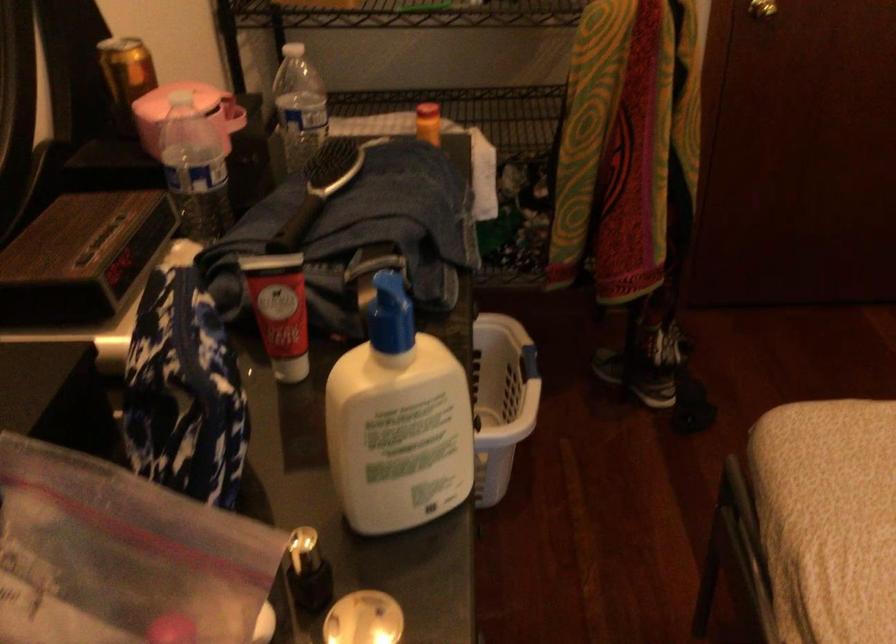
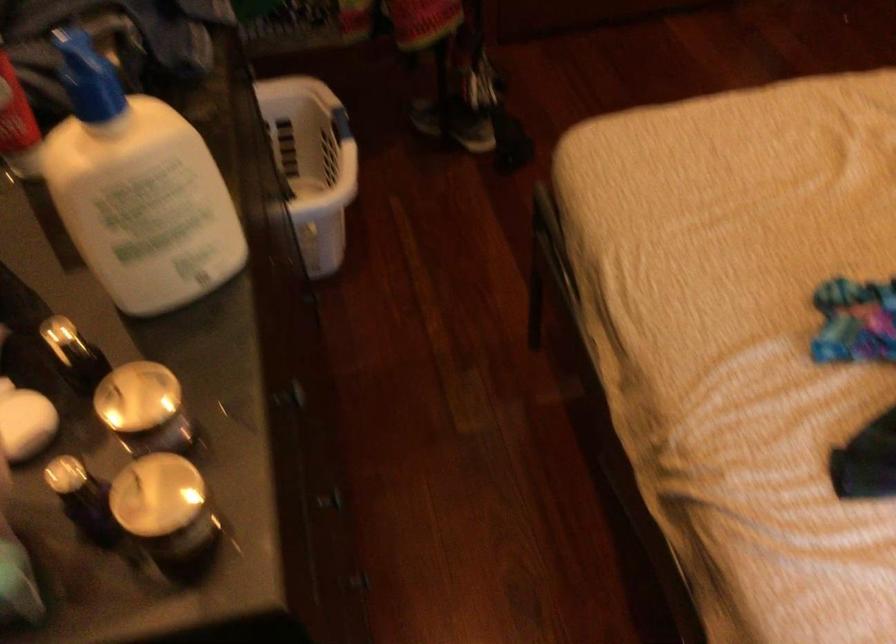
Question: Based on the continuous images, in which direction is the camera rotating? Reply with the corresponding letter.

Choices:
 (A) Left
 (B) Right
 (C) Up
 (D) Down

Answer: (D)